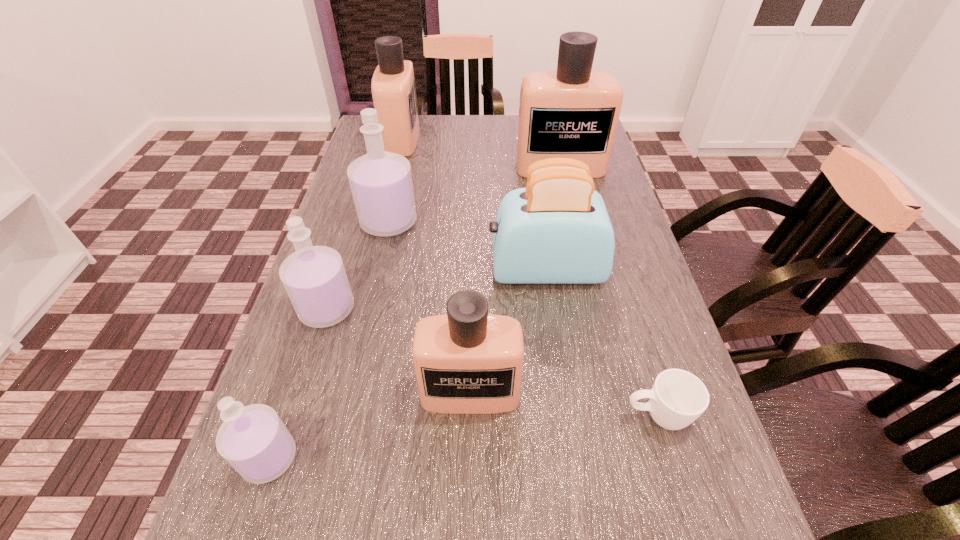
The image size is (960, 540). In order to click on free location at the far edge in this screenshot , I will do `click(509, 124)`.

In the image, there is a desktop. Identify the location of vacant space at the left edge. This screenshot has height=540, width=960. 374,295.

Where is `vacant area at the right edge of the desktop`? Image resolution: width=960 pixels, height=540 pixels. vacant area at the right edge of the desktop is located at coordinates (651, 497).

At what (x,y) coordinates should I click in order to perform the action: click on free spot between the third biggest beige perfume and the biggest purple perfume. Please return your answer as a coordinate pair (x, y). Looking at the image, I should click on (429, 307).

The width and height of the screenshot is (960, 540). Find the location of `vacant area between the tallest perfume and the second nearest purple perfume`. vacant area between the tallest perfume and the second nearest purple perfume is located at coordinates (444, 238).

Where is `vacant region between the farthest purple perfume and the nearest purple perfume`? This screenshot has width=960, height=540. vacant region between the farthest purple perfume and the nearest purple perfume is located at coordinates (329, 340).

Image resolution: width=960 pixels, height=540 pixels. What are the coordinates of `free spot between the tallest object and the smallest purple perfume` in the screenshot? It's located at (415, 313).

This screenshot has width=960, height=540. Identify the location of object that is the closest to the cup. (467, 361).

Point out which object is positioned as the sixth nearest to the nearest purple perfume. Please provide its 2D coordinates. Your answer should be formatted as a tuple, i.e. [(x, y)], where the tuple contains the x and y coordinates of a point satisfying the conditions above.

[(678, 398)]

Locate which perfume is the closest to the second biggest beige perfume. Please provide its 2D coordinates. Your answer should be formatted as a tuple, i.e. [(x, y)], where the tuple contains the x and y coordinates of a point satisfying the conditions above.

[(381, 184)]